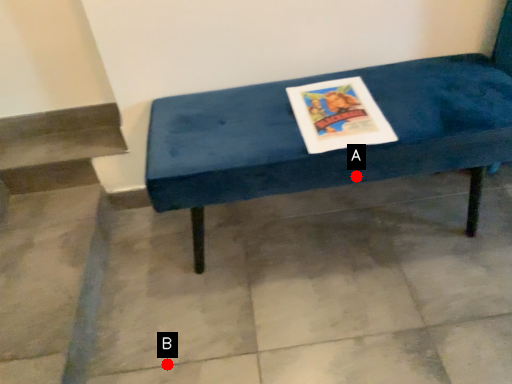
Question: Two points are circled on the image, labeled by A and B beside each circle. Which point is further to the camera?

Choices:
 (A) A is further
 (B) B is further

Answer: (B)